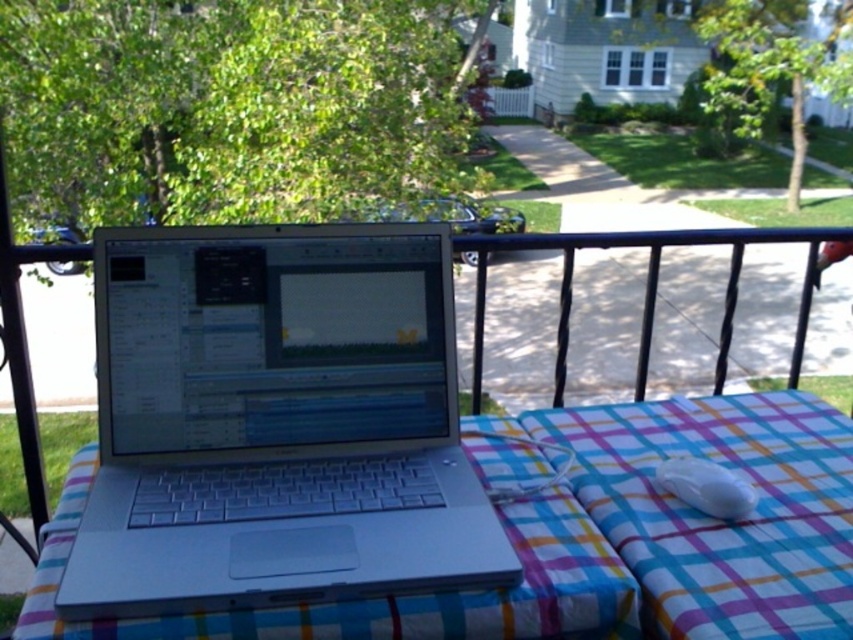
You are standing on the balcony looking at the laptop and the two points. Which point, point (x=434, y=625) or point (x=656, y=474), is nearer to you?

Point (x=434, y=625) is closer to the camera than point (x=656, y=474), so it is nearer to you.

You are a photographer setting up a shoot on a balcony. You have a silver metallic laptop at center and a plaid fabric at center. Which object is closer to the edge of the balcony?

The silver metallic laptop at center is closer to the edge of the balcony because it is in front of the plaid fabric at center, meaning it is positioned nearer to the viewer and thus closer to the balcony edge.

You are organizing a small outdoor workspace on a balcony. You have a plaid fabric at center and a white glossy mouse at lower right. Which object takes up more space on the table?

The plaid fabric at center is larger in size than the white glossy mouse at lower right, so it takes up more space on the table.